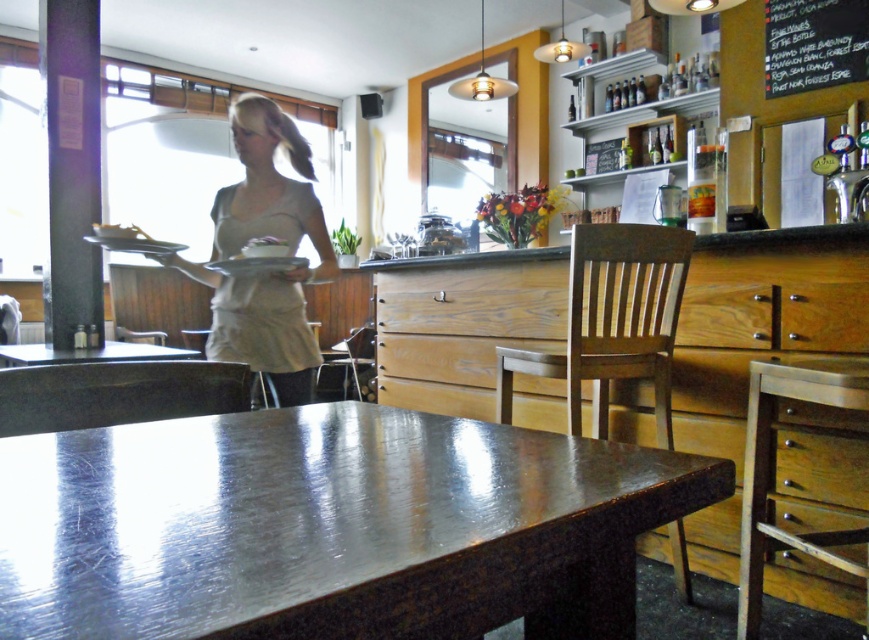
Is beige fabric apron at center above matte white platter at center?

Indeed, beige fabric apron at center is positioned over matte white platter at center.

Is beige fabric apron at center to the right of matte white platter at center from the viewer's perspective?

In fact, beige fabric apron at center is to the left of matte white platter at center.

Who is more forward, (x=280, y=352) or (x=274, y=260)?

Point (x=274, y=260) is in front.

This screenshot has height=640, width=869. In order to click on beige fabric apron at center in this screenshot , I will do `click(264, 237)`.

Is shiny metallic table at center in front of black chalkboard at upper right?

That is True.

Who is positioned more to the right, shiny metallic table at center or black chalkboard at upper right?

Result: Positioned to the right is black chalkboard at upper right.

I want to click on shiny metallic table at center, so click(330, 528).

Image resolution: width=869 pixels, height=640 pixels. In order to click on shiny metallic table at center in this screenshot , I will do `click(330, 528)`.

Can you confirm if shiny metallic table at center is positioned above matte white platter at center?

Actually, shiny metallic table at center is below matte white platter at center.

Is shiny metallic table at center wider than matte white platter at center?

Yes, shiny metallic table at center is wider than matte white platter at center.

Identify the location of shiny metallic table at center. (330, 528).